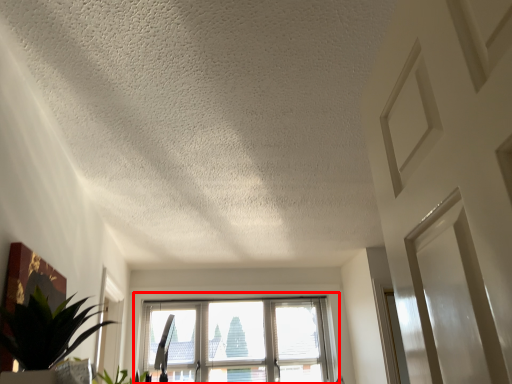
Question: From the image's perspective, what is the correct spatial positioning of window (annotated by the red box) in reference to houseplant?

Choices:
 (A) above
 (B) below

Answer: (B)